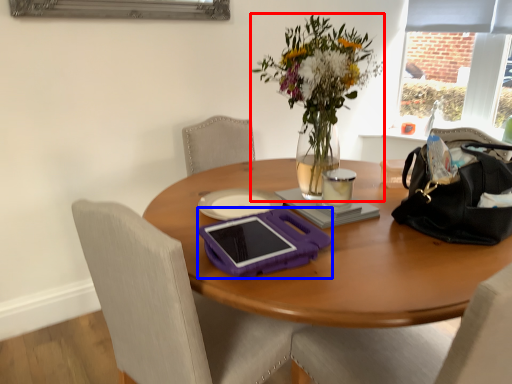
Question: Which of the following is the farthest to the observer, flower (highlighted by a red box) or tablet computer (highlighted by a blue box)?

Choices:
 (A) flower
 (B) tablet computer

Answer: (A)